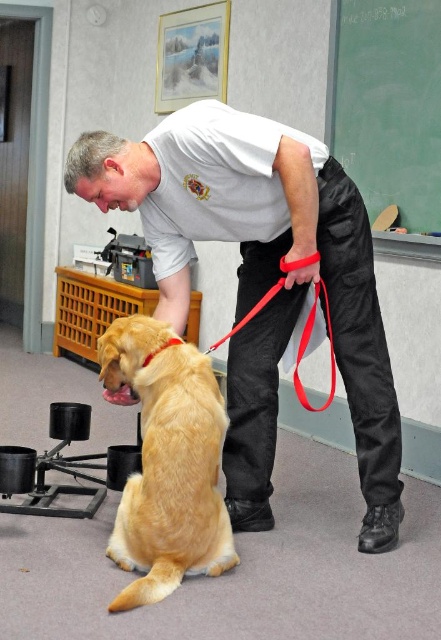
Question: Considering the relative positions of golden fur dog at center and green chalkboard at upper right in the image provided, where is golden fur dog at center located with respect to green chalkboard at upper right?

Choices:
 (A) above
 (B) below

Answer: (B)

Question: Which object is positioned closest to the green chalkboard at upper right?

Choices:
 (A) golden fur dog at center
 (B) red nylon leash at lower center
 (C) matte white shirt at center

Answer: (C)

Question: Which point is closer to the camera?

Choices:
 (A) red nylon leash at lower center
 (B) golden fur dog at center
 (C) green chalkboard at upper right
 (D) matte white shirt at center

Answer: (B)

Question: Which object appears farthest from the camera in this image?

Choices:
 (A) matte white shirt at center
 (B) golden fur dog at center
 (C) green chalkboard at upper right
 (D) red nylon leash at lower center

Answer: (C)

Question: Is the position of golden fur dog at center less distant than that of red nylon leash at lower center?

Choices:
 (A) no
 (B) yes

Answer: (B)

Question: Considering the relative positions of matte white shirt at center and green chalkboard at upper right in the image provided, where is matte white shirt at center located with respect to green chalkboard at upper right?

Choices:
 (A) below
 (B) above

Answer: (A)